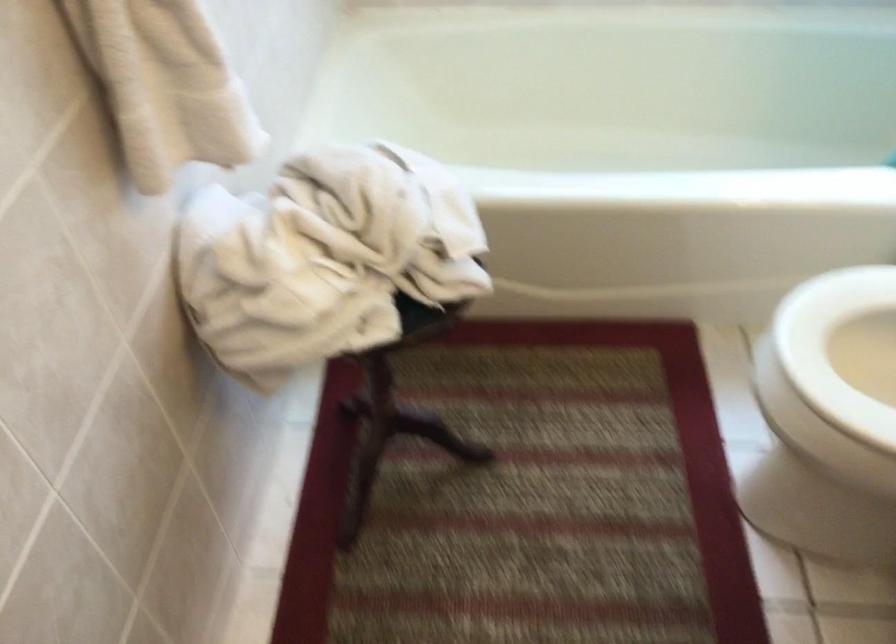
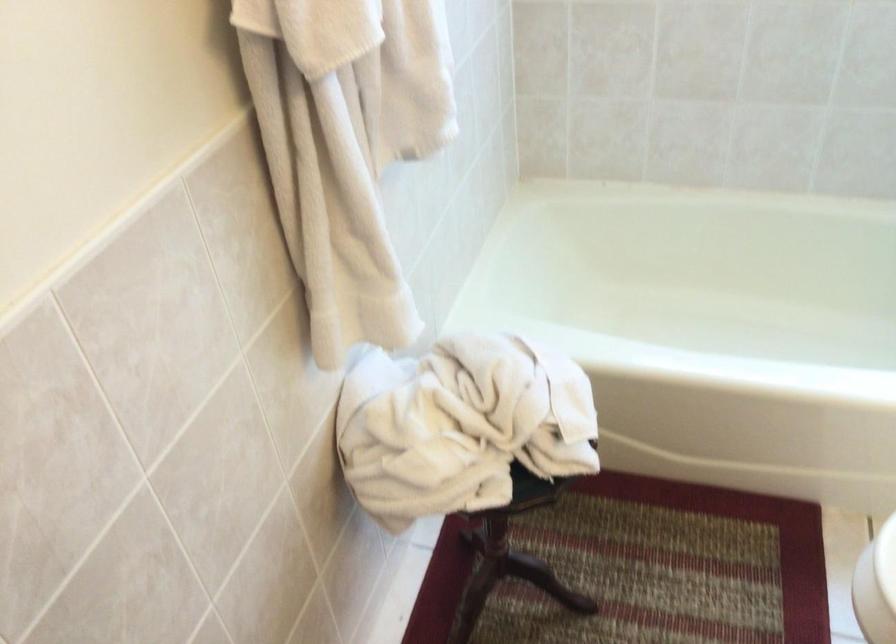
In the second image, find the point that corresponds to the point at 306,258 in the first image.

(440, 431)